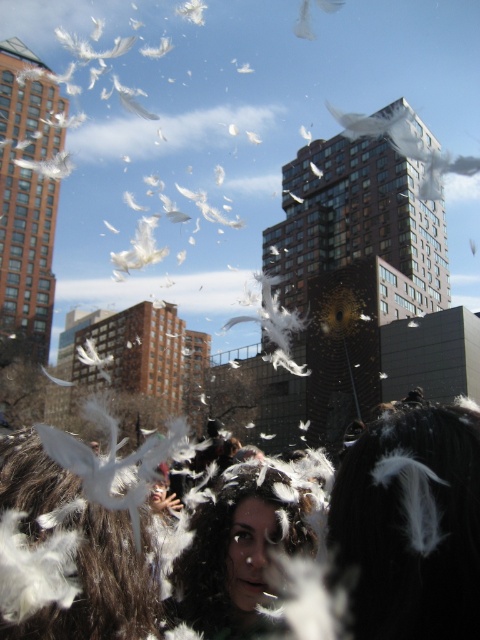
Does white feathered hair at center have a greater height compared to white feathered bird at center?

No.

Can you confirm if white feathered hair at center is thinner than white feathered bird at center?

Correct, white feathered hair at center's width is less than white feathered bird at center's.

Is point (456, 509) more distant than point (113, 476)?

That is False.

This screenshot has height=640, width=480. I want to click on white feathered hair at center, so click(x=410, y=525).

Which of these two, white feathered hair at center or dark brown hair at center, stands shorter?

dark brown hair at center is shorter.

Which is more to the right, white feathered hair at center or dark brown hair at center?

white feathered hair at center is more to the right.

Find the location of a particular element. The width and height of the screenshot is (480, 640). white feathered hair at center is located at coordinates (410, 525).

Between dark brown hair at center and white feathered bird at center, which one has more height?

white feathered bird at center is taller.

Is dark brown hair at center to the left of white feathered bird at center from the viewer's perspective?

Incorrect, dark brown hair at center is not on the left side of white feathered bird at center.

Is point (264, 484) closer to camera compared to point (84, 465)?

No.

This screenshot has height=640, width=480. Identify the location of dark brown hair at center. (238, 552).